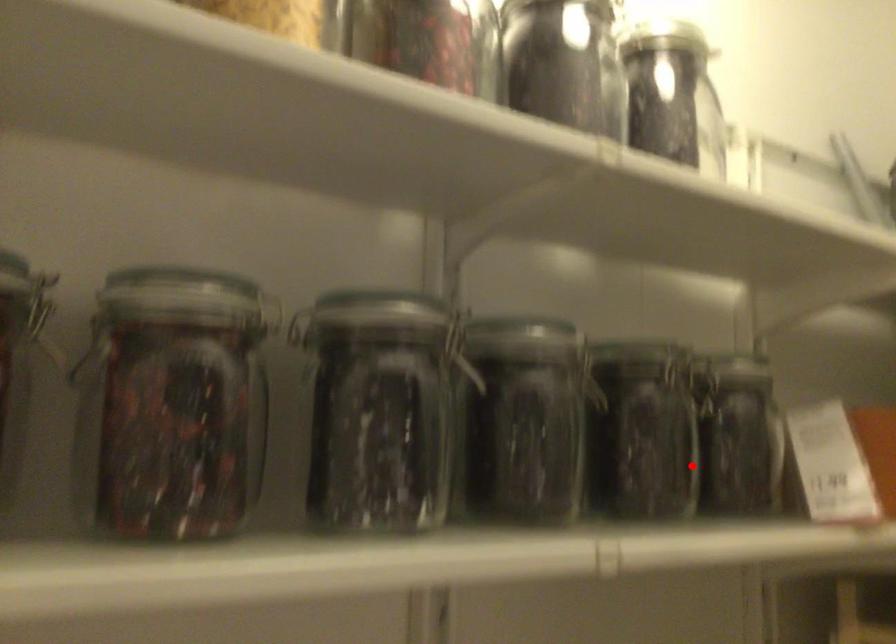
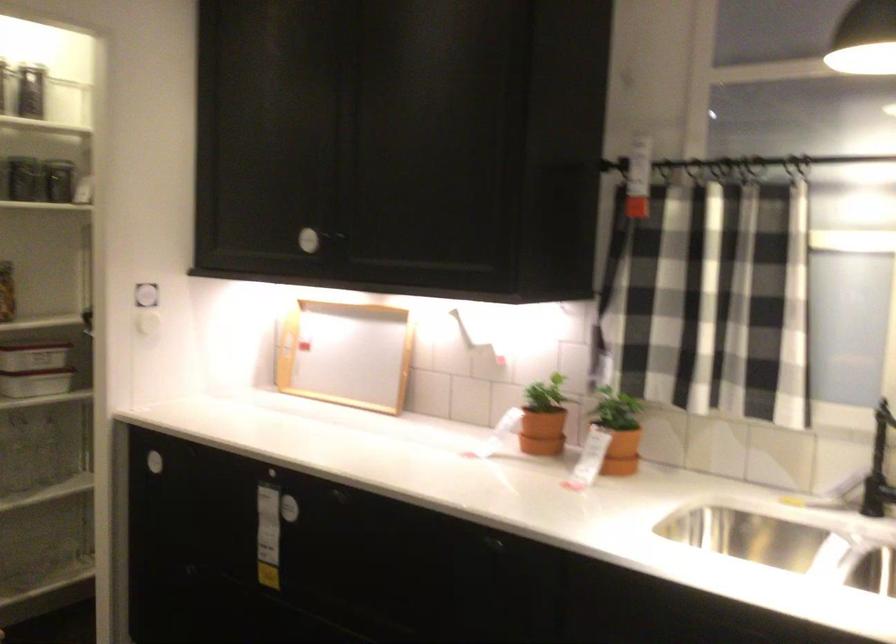
Where in the second image is the point corresponding to the highlighted location from the first image?

(31, 187)